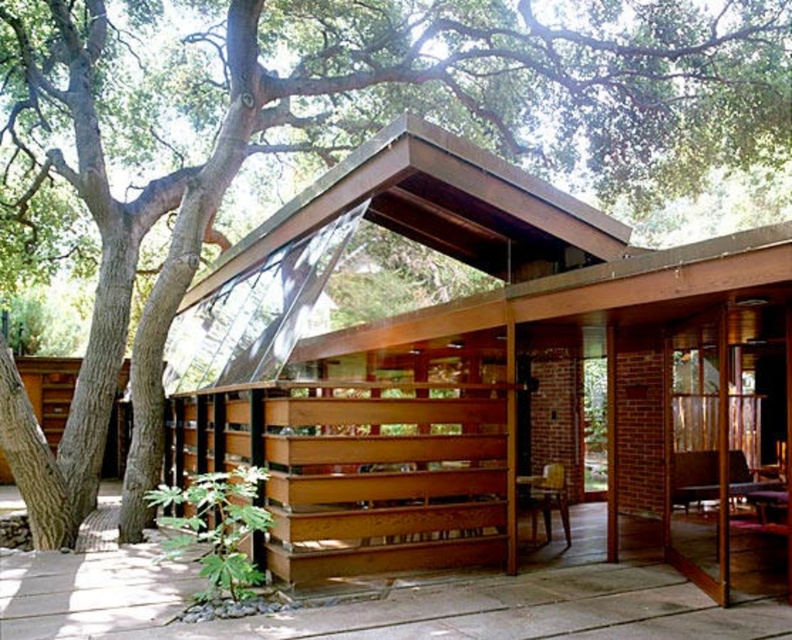
You are standing on the brown wooden deck at lower center and want to sit down on the wooden chair at center. Can you reach the chair without stepping off the deck?

The brown wooden deck at lower center is shorter than the wooden chair at center, so you can reach the chair without stepping off the deck because the deck extends far enough to allow access to the chair.

You are standing on the brown wooden deck at lower center and want to sit down. Is the wooden chair at center directly above you?

Yes, the wooden chair at center is directly above the brown wooden deck at lower center since the deck is positioned under the chair.

You are standing at the entrance of the building and want to reach the brown wooden deck at lower center. What are the coordinates of the deck you should head towards?

The coordinates of the brown wooden deck at lower center are point (383, 602).